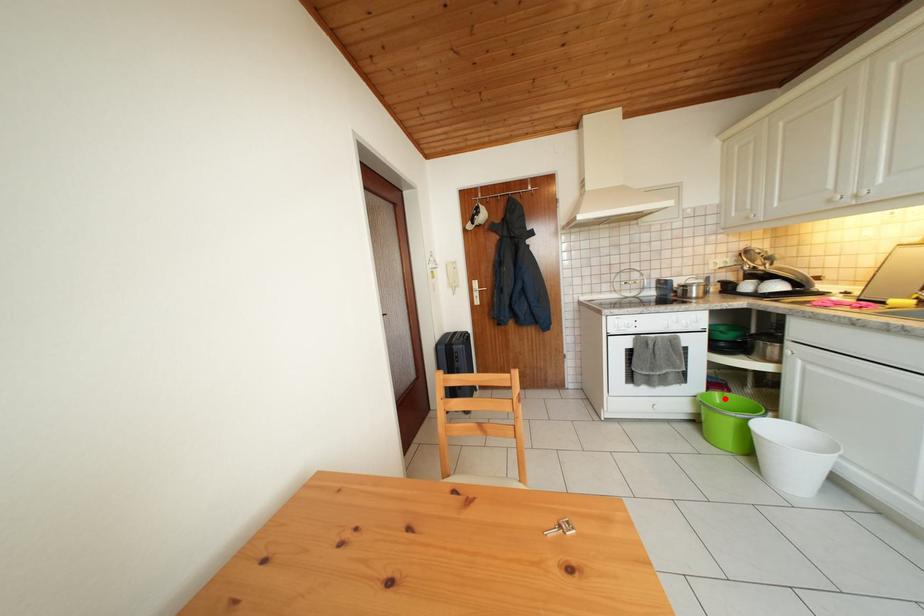
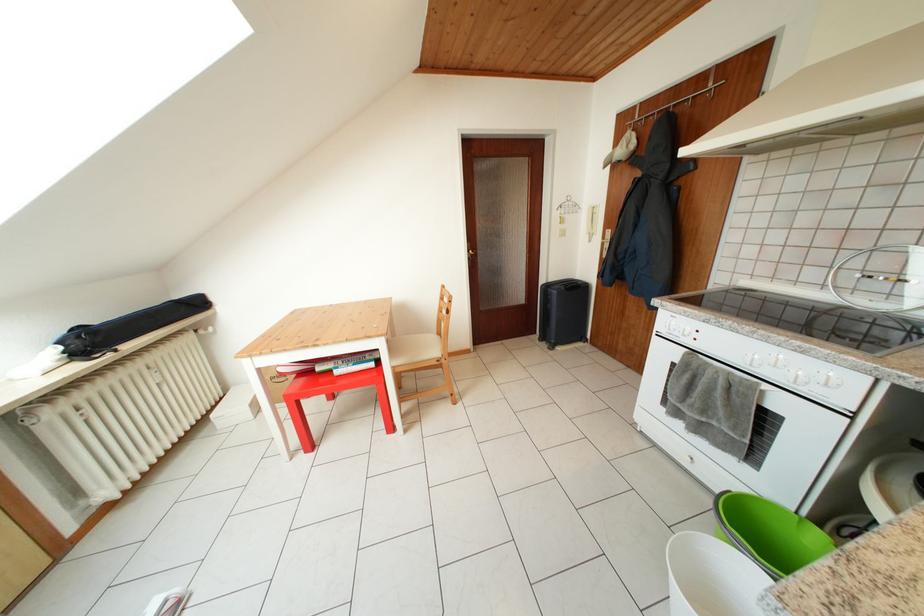
Question: I am providing you with two images of the same scene from different viewpoints. In image1, a red point is highlighted. Considering the same 3D point in image2, which of the following is correct?

Choices:
 (A) It is closer
 (B) It is farther

Answer: (B)